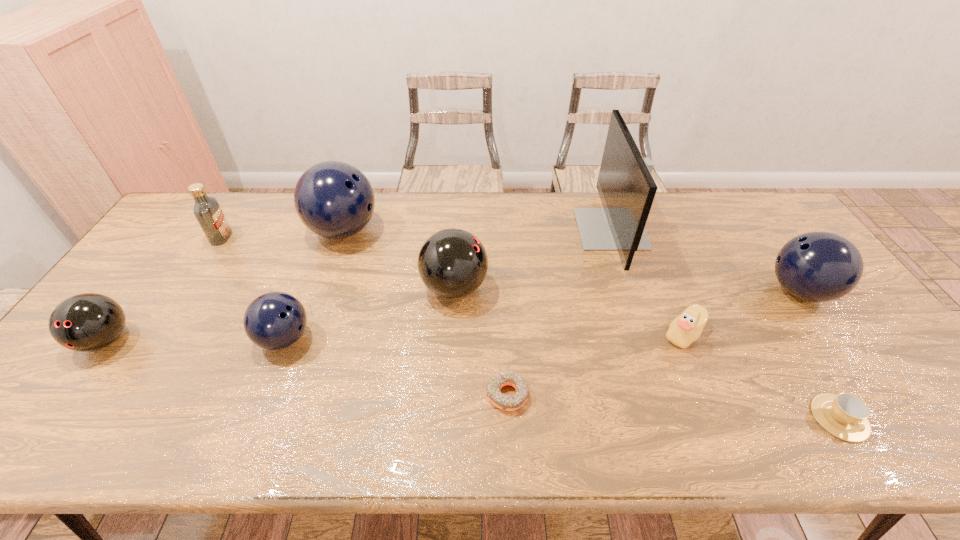
Image resolution: width=960 pixels, height=540 pixels. In order to click on vacant area located 0.110m on the surface of the ninth shortest object near the finger holes in this screenshot , I will do `click(414, 231)`.

Locate an element on the screen. The width and height of the screenshot is (960, 540). vacant space positioned 0.390m on the front-facing side of the vodka is located at coordinates (350, 238).

At what (x,y) coordinates should I click in order to perform the action: click on vacant space situated 0.180m on the surface of the rightmost blue bowling ball near the finger holes. Please return your answer as a coordinate pair (x, y). This screenshot has height=540, width=960. Looking at the image, I should click on (703, 291).

At what (x,y) coordinates should I click in order to perform the action: click on free spot located 0.310m on the surface of the rightmost blue bowling ball near the finger holes. Please return your answer as a coordinate pair (x, y). The height and width of the screenshot is (540, 960). Looking at the image, I should click on (658, 291).

At what (x,y) coordinates should I click in order to perform the action: click on free space located 0.240m on the surface of the rightmost blue bowling ball near the finger holes. Please return your answer as a coordinate pair (x, y). The height and width of the screenshot is (540, 960). Looking at the image, I should click on [682, 291].

Image resolution: width=960 pixels, height=540 pixels. I want to click on vacant area situated on the surface of the farther black bowling ball near the finger holes, so click(561, 288).

I want to click on vacant space located 0.070m on the surface of the left black bowling ball near the finger holes, so click(70, 389).

Where is `vacant region located 0.210m on the surface of the nearest blue bowling ball near the finger holes`? Image resolution: width=960 pixels, height=540 pixels. vacant region located 0.210m on the surface of the nearest blue bowling ball near the finger holes is located at coordinates (394, 339).

Find the location of a particular element. vacant position located at the beak of the eighth tallest object is located at coordinates (562, 334).

Where is `blank space located at the beak of the eighth tallest object`? The width and height of the screenshot is (960, 540). blank space located at the beak of the eighth tallest object is located at coordinates (615, 334).